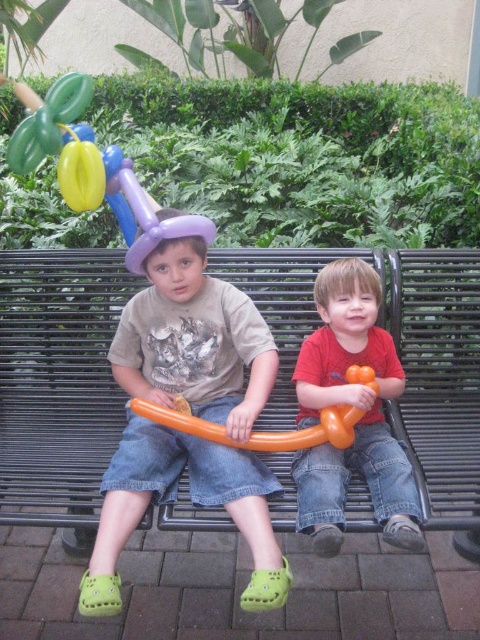
You are a photographer standing in front of the black metal bench at center and the matte orange balloon animal at center. Which object is closer to you?

The black metal bench at center is closer to you than the matte orange balloon animal at center.

You are a photographer setting up a shot of the two children sitting on the black metal bench. You want to ensure that the matte purple balloon hat at center and the orange rubber balloon at center are both visible in the frame. Based on their heights, which object should you position closer to the camera to avoid one blocking the other?

The matte purple balloon hat at center is taller than the orange rubber balloon at center. To avoid the taller hat blocking the balloon, position the orange rubber balloon at center closer to the camera so it remains visible.